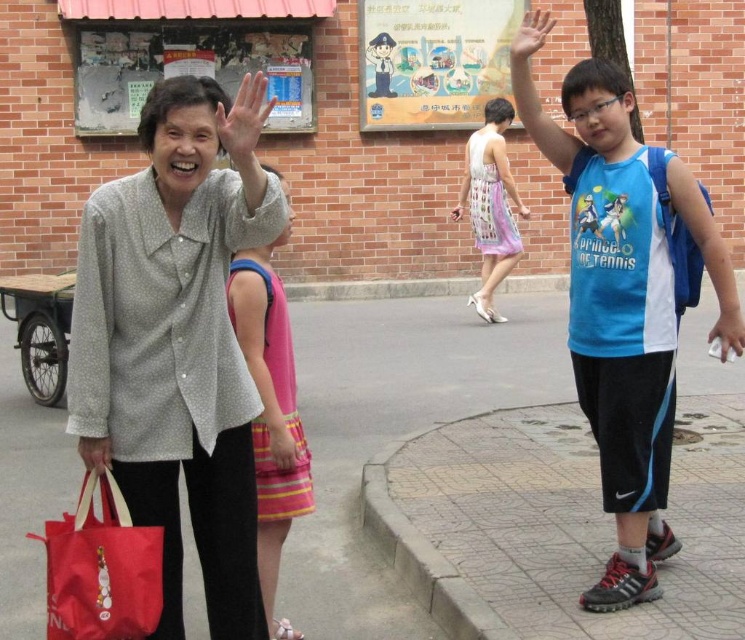
Looking at the scene, there is a scratched paperboard at upper left and a matte gray hand at upper left. Which one is positioned more to the left side?

The scratched paperboard at upper left is positioned more to the left than the matte gray hand at upper left.

You are a photographer trying to capture a photo of the pink striped dress at center and the matte red bag at lower left. Which object should you focus on first if you want to include both in your frame without moving the camera?

The pink striped dress at center is to the right of the matte red bag at lower left, so you should focus on the matte red bag at lower left first to ensure both are in frame without moving the camera.